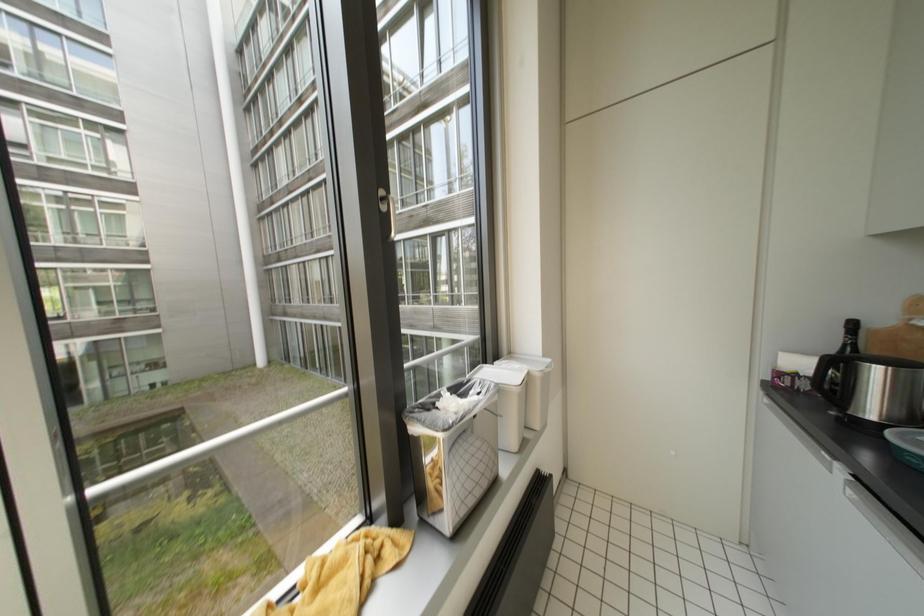
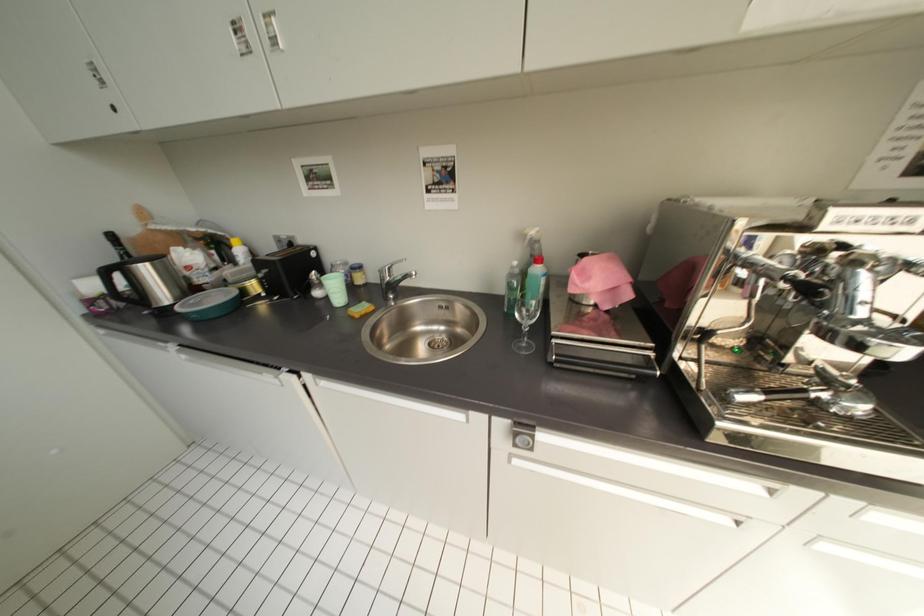
First-person continuous shooting, in which direction is the camera rotating?

The rotation direction of the camera is right-down.